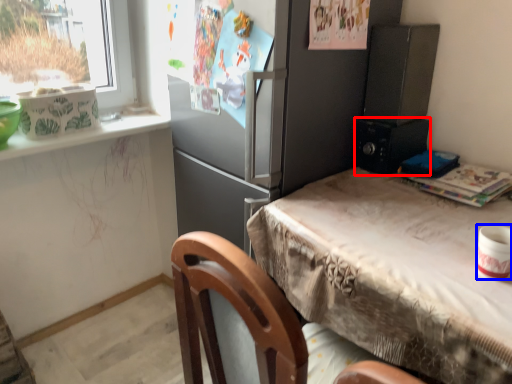
Question: Among these objects, which one is farthest to the camera, appliance (highlighted by a red box) or appliance (highlighted by a blue box)?

Choices:
 (A) appliance
 (B) appliance

Answer: (A)